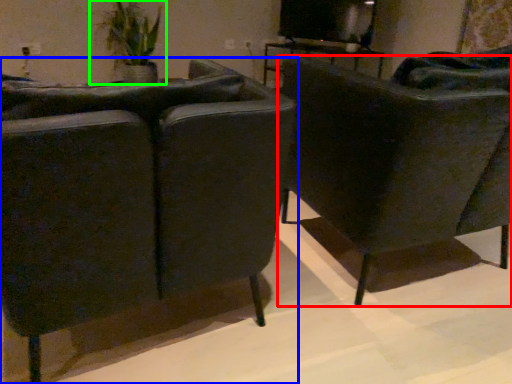
Question: Which object is positioned farthest from chair (highlighted by a red box)? Select from chair (highlighted by a blue box) and houseplant (highlighted by a green box).

Choices:
 (A) chair
 (B) houseplant

Answer: (B)